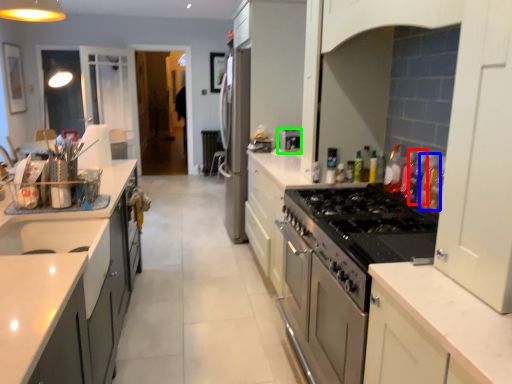
Question: Which object is positioned closest to bottle (highlighted by a red box)? Select from bottle (highlighted by a blue box) and appliance (highlighted by a green box).

Choices:
 (A) bottle
 (B) appliance

Answer: (A)